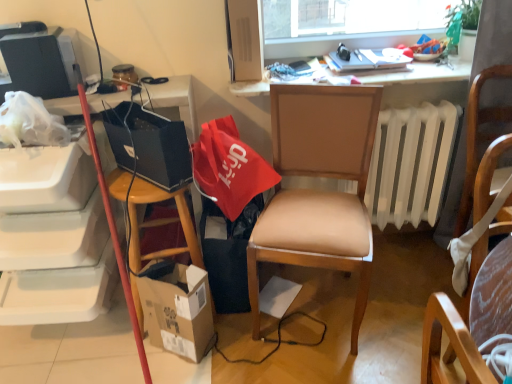
The image size is (512, 384). Describe the element at coordinates (368, 60) in the screenshot. I see `matte black laptop at upper center` at that location.

In order to face black fabric trash bin/can at lower center, should I rotate leftwards or rightwards?

To face it directly, rotate left by 3.576 degrees.

Describe the element at coordinates (411, 164) in the screenshot. I see `white plastic radiator at center right` at that location.

The height and width of the screenshot is (384, 512). What are the coordinates of `light brown leather chair at center, which is counted as the second chair, starting from the right` in the screenshot? It's located at coord(319,191).

Image resolution: width=512 pixels, height=384 pixels. Describe the element at coordinates (319, 191) in the screenshot. I see `light brown leather chair at center, which is counted as the second chair, starting from the right` at that location.

The height and width of the screenshot is (384, 512). I want to click on matte black laptop at left, which ranks as the second handbag in right-to-left order, so click(x=149, y=145).

From the image's perspective, would you say matte black television at upper left is positioned over light brown leather chair at center, the 1th chair in the left-to-right sequence?

Yes, from the image's perspective, matte black television at upper left is on top of light brown leather chair at center, the 1th chair in the left-to-right sequence.

Does matte black television at upper left have a smaller size compared to light brown leather chair at center, which is counted as the second chair, starting from the right?

Indeed, matte black television at upper left has a smaller size compared to light brown leather chair at center, which is counted as the second chair, starting from the right.

Is matte black television at upper left positioned far away from light brown leather chair at center, the 1th chair in the left-to-right sequence?

matte black television at upper left is actually quite close to light brown leather chair at center, the 1th chair in the left-to-right sequence.

Does matte black television at upper left appear on the left side of light brown leather chair at center, the 1th chair in the left-to-right sequence?

Indeed, matte black television at upper left is positioned on the left side of light brown leather chair at center, the 1th chair in the left-to-right sequence.

What's the angular difference between black fabric trash bin/can at lower center and matte black laptop at upper center's facing directions?

They differ by 0.468 degrees in their facing directions.

Looking at this image, can you confirm if black fabric trash bin/can at lower center is smaller than matte black laptop at upper center?

No, black fabric trash bin/can at lower center is not smaller than matte black laptop at upper center.

Is black fabric trash bin/can at lower center far from matte black laptop at upper center?

Actually, black fabric trash bin/can at lower center and matte black laptop at upper center are a little close together.

Can you confirm if wooden chair at right, marked as the 2th chair in a left-to-right arrangement, is taller than cardboard box at lower left?

Yes, wooden chair at right, marked as the 2th chair in a left-to-right arrangement, is taller than cardboard box at lower left.

Is cardboard box at lower left inside wooden chair at right, the first chair viewed from the right?

No, cardboard box at lower left is not a part of wooden chair at right, the first chair viewed from the right.

Locate an element on the screen. This screenshot has width=512, height=384. box located behind the wooden chair at right, marked as the 2th chair in a left-to-right arrangement is located at coordinates (177, 308).

Does point (453, 33) come in front of point (445, 149)?

Yes, point (453, 33) is in front of point (445, 149).

Does green leafy plant at upper right have a smaller size compared to white plastic radiator at center right?

Yes.

Based on the photo, how distant is green leafy plant at upper right from white plastic radiator at center right?

green leafy plant at upper right and white plastic radiator at center right are 17.65 inches apart from each other.

From the image's perspective, is green leafy plant at upper right below white plastic radiator at center right?

No, from the image's perspective, green leafy plant at upper right is not beneath white plastic radiator at center right.

In the scene shown: From the image's perspective, between cardboard box at lower left and wooden chair at right, marked as the 2th chair in a left-to-right arrangement, which one is located above?

wooden chair at right, marked as the 2th chair in a left-to-right arrangement, from the image's perspective.

Are cardboard box at lower left and wooden chair at right, the first chair viewed from the right, making contact?

cardboard box at lower left and wooden chair at right, the first chair viewed from the right, are clearly separated.

Consider the image. Which is behind, cardboard box at lower left or wooden chair at right, marked as the 2th chair in a left-to-right arrangement?

Positioned behind is cardboard box at lower left.

Can we say cardboard box at lower left lies outside wooden chair at right, marked as the 2th chair in a left-to-right arrangement?

Absolutely, cardboard box at lower left is external to wooden chair at right, marked as the 2th chair in a left-to-right arrangement.

Is matte black laptop at left, which ranks as the second handbag in right-to-left order, not inside green leafy plant at upper right?

Indeed, matte black laptop at left, which ranks as the second handbag in right-to-left order, is completely outside green leafy plant at upper right.

Can you confirm if matte black laptop at left, the 1th handbag when ordered from left to right, is bigger than green leafy plant at upper right?

Yes.

Is matte black laptop at left, the 1th handbag when ordered from left to right, shorter than green leafy plant at upper right?

In fact, matte black laptop at left, the 1th handbag when ordered from left to right, may be taller than green leafy plant at upper right.

Are matte black laptop at left, the 1th handbag when ordered from left to right, and green leafy plant at upper right located far from each other?

That's right, there is a large distance between matte black laptop at left, the 1th handbag when ordered from left to right, and green leafy plant at upper right.

From their relative heights in the image, would you say wooden desk at upper center is taller or shorter than matte black laptop at left, which ranks as the second handbag in right-to-left order?

Considering their sizes, wooden desk at upper center has less height than matte black laptop at left, which ranks as the second handbag in right-to-left order.

Are wooden desk at upper center and matte black laptop at left, the 1th handbag when ordered from left to right, beside each other?

No, wooden desk at upper center is not in contact with matte black laptop at left, the 1th handbag when ordered from left to right.

Which object is wider, wooden desk at upper center or matte black laptop at left, the 1th handbag when ordered from left to right?

wooden desk at upper center is wider.

Is wooden desk at upper center completely or partially outside of matte black laptop at left, the 1th handbag when ordered from left to right?

Absolutely, wooden desk at upper center is external to matte black laptop at left, the 1th handbag when ordered from left to right.

What are the coordinates of `the 1st chair below the matte black television at upper left (from the image's perspective)` in the screenshot? It's located at (319, 191).

Locate an element on the screen. trash bin/can beneath the matte black laptop at upper center (from a real-world perspective) is located at coordinates (228, 254).

When comparing their distances from black fabric trash bin/can at lower center, does green leafy plant at upper right or matte black television at upper left seem closer?

matte black television at upper left is positioned closer to the anchor black fabric trash bin/can at lower center.

Based on the photo, considering their positions, is wooden desk at upper center positioned closer to green leafy plant at upper right than wooden chair at right, marked as the 2th chair in a left-to-right arrangement?

wooden desk at upper center lies closer to green leafy plant at upper right than the other object.

Looking at the image, which one is located further to green leafy plant at upper right, red fabric bag at center, arranged as the 2th handbag when viewed from the left, or matte black television at upper left?

matte black television at upper left is positioned further to the anchor green leafy plant at upper right.

When comparing their distances from green leafy plant at upper right, does light brown leather chair at center, the 1th chair in the left-to-right sequence, or wooden desk at upper center seem further?

Based on the image, light brown leather chair at center, the 1th chair in the left-to-right sequence, appears to be further to green leafy plant at upper right.

Estimate the real-world distances between objects in this image. Which object is closer to red fabric bag at center, arranged as the first handbag when viewed from the right, green leafy plant at upper right or matte black television at upper left?

matte black television at upper left.

Estimate the real-world distances between objects in this image. Which object is closer to cardboard box at lower left, wooden chair at right, the first chair viewed from the right, or green leafy plant at upper right?

The object closer to cardboard box at lower left is wooden chair at right, the first chair viewed from the right.

Considering their positions, is cardboard box at lower left positioned further to light brown leather chair at center, the 1th chair in the left-to-right sequence, than green leafy plant at upper right?

green leafy plant at upper right is positioned further to the anchor light brown leather chair at center, the 1th chair in the left-to-right sequence.

Which object lies nearer to the anchor point wooden desk at upper center, white plastic radiator at center right or cardboard box at lower left?

white plastic radiator at center right is closer to wooden desk at upper center.

Find the location of `trash bin/can between matte black laptop at left, the 1th handbag when ordered from left to right, and wooden chair at right, marked as the 2th chair in a left-to-right arrangement`. trash bin/can between matte black laptop at left, the 1th handbag when ordered from left to right, and wooden chair at right, marked as the 2th chair in a left-to-right arrangement is located at coordinates (228, 254).

Locate an element on the screen. The image size is (512, 384). radiator between light brown leather chair at center, the 1th chair in the left-to-right sequence, and matte black laptop at upper center from front to back is located at coordinates (411, 164).

Find the location of a particular element. This screenshot has width=512, height=384. trash bin/can between matte black television at upper left and red fabric bag at center, arranged as the 2th handbag when viewed from the left is located at coordinates (228, 254).

In order to click on trash bin/can between matte black television at upper left and matte black laptop at upper center from left to right in this screenshot , I will do `click(228, 254)`.